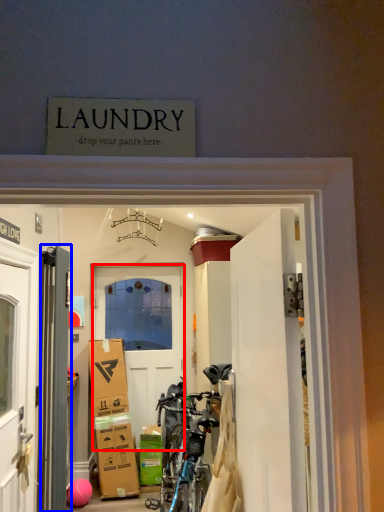
Question: Among these objects, which one is nearest to the camera, door (highlighted by a red box) or door (highlighted by a blue box)?

Choices:
 (A) door
 (B) door

Answer: (B)